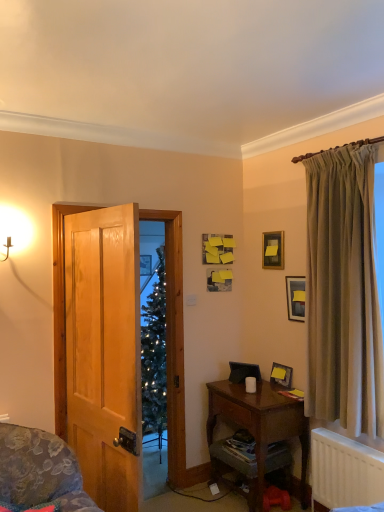
This screenshot has width=384, height=512. In order to click on vacant area that is in front of matte black picture frame at lower right, which appears as the 1th picture frame when ordered from the bottom in this screenshot , I will do `click(283, 394)`.